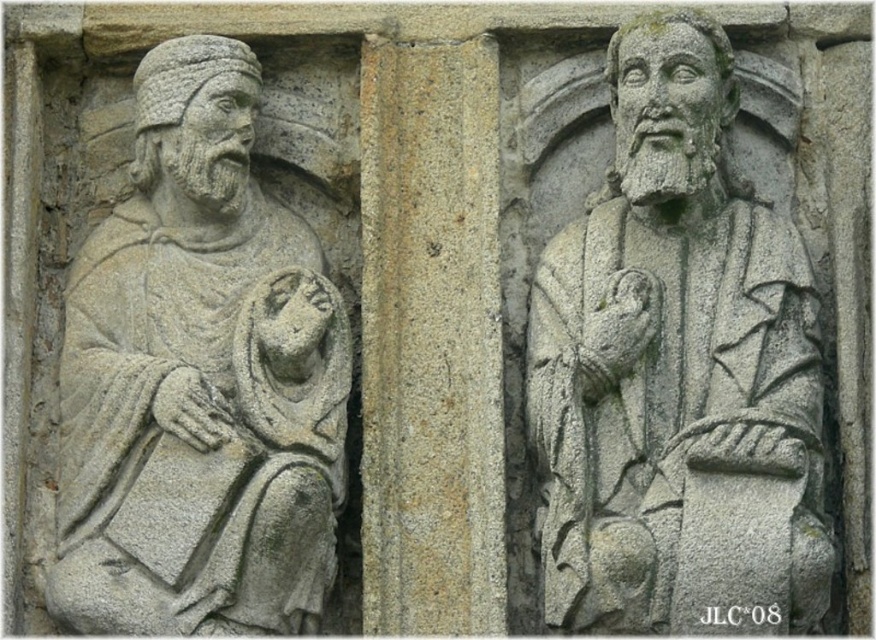
Question: Is gray stone sculpture at right smaller than gray stone figure at left?

Choices:
 (A) yes
 (B) no

Answer: (B)

Question: Can you confirm if gray stone sculpture at right is positioned below gray stone figure at left?

Choices:
 (A) yes
 (B) no

Answer: (B)

Question: Which point is closer to the camera?

Choices:
 (A) gray stone figure at left
 (B) gray stone sculpture at right

Answer: (B)

Question: Which point is farther to the camera?

Choices:
 (A) gray stone figure at left
 (B) gray stone sculpture at right

Answer: (A)

Question: Does gray stone sculpture at right appear on the right side of gray stone figure at left?

Choices:
 (A) no
 (B) yes

Answer: (B)